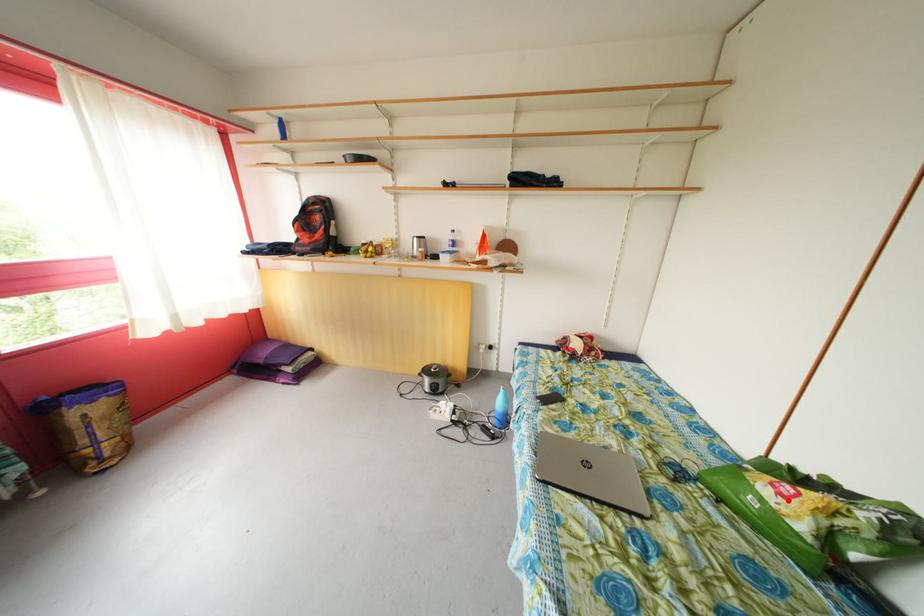
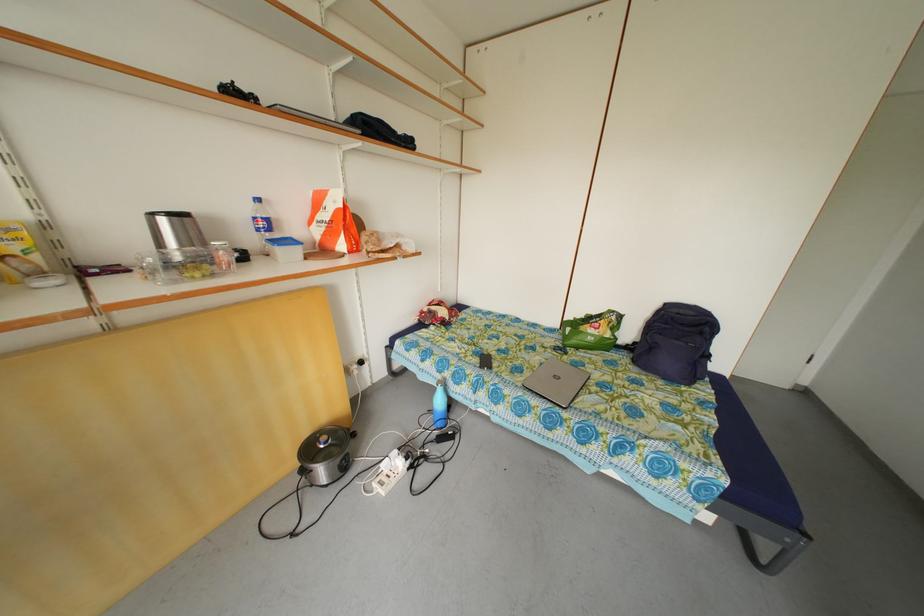
The point at the highlighted location is marked in the first image. Where is the corresponding point in the second image?

(602, 334)